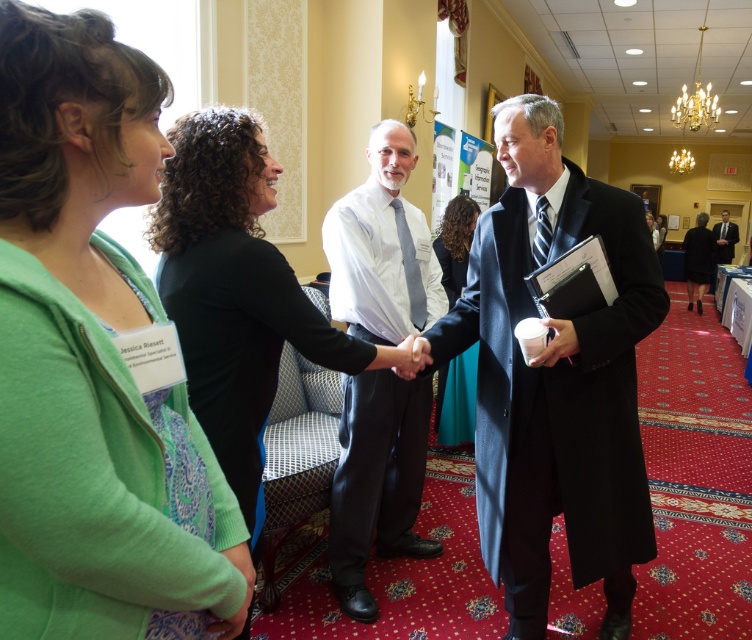
Can you confirm if white shirt at center is thinner than teal satin dress at center?

No.

Between white shirt at center and teal satin dress at center, which one is positioned lower?

teal satin dress at center

Who is more distant from viewer, (364,264) or (450,376)?

Point (450,376)

Identify the location of white shirt at center. (378, 480).

Measure the distance from green fabric cardigan at upper left to dark suit at right.

green fabric cardigan at upper left is 10.82 meters from dark suit at right.

Which is in front, point (108, 396) or point (720, 262)?

Point (108, 396)

In order to click on green fabric cardigan at upper left in this screenshot , I will do `click(92, 360)`.

Can you confirm if dark blue suit at center is wider than black wool suit at right?

Yes.

Which is in front, point (620, 257) or point (702, 289)?

Point (620, 257)

I want to click on dark blue suit at center, so click(555, 378).